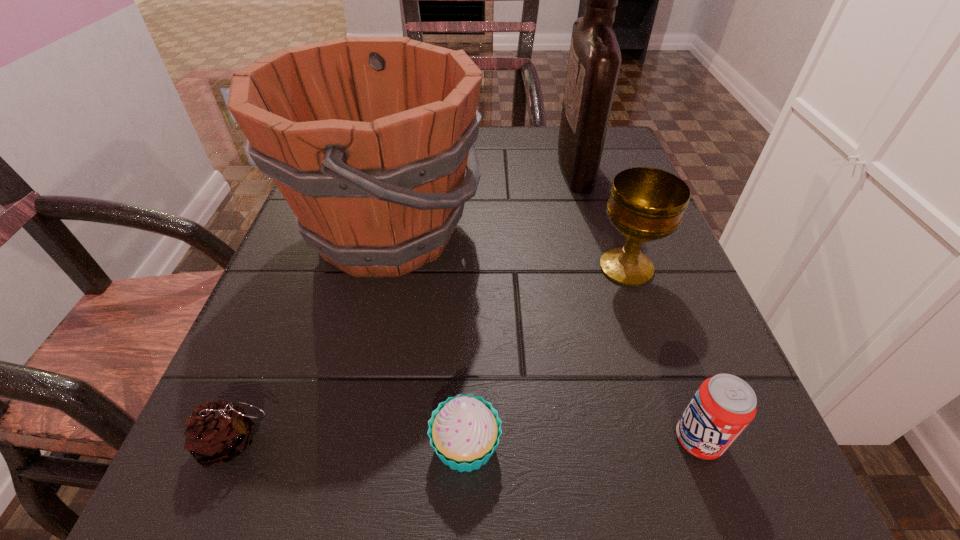
In order to click on free point between the cupcake and the second tallest object in this screenshot , I will do `click(426, 339)`.

Identify the location of vacant space in between the soda can and the chalice. The image size is (960, 540). (662, 353).

This screenshot has width=960, height=540. What are the coordinates of `free space between the chalice and the bucket` in the screenshot? It's located at (507, 250).

At what (x,y) coordinates should I click in order to perform the action: click on vacant point located between the fifth shortest object and the liquor. Please return your answer as a coordinate pair (x, y). Looking at the image, I should click on (481, 199).

This screenshot has width=960, height=540. Identify the location of the fourth closest object to the cupcake. (646, 204).

Locate which object ranks fifth in proximity to the soda can. Please provide its 2D coordinates. Your answer should be formatted as a tuple, i.e. [(x, y)], where the tuple contains the x and y coordinates of a point satisfying the conditions above.

[(217, 432)]

Locate an element on the screen. This screenshot has width=960, height=540. free space that satisfies the following two spatial constraints: 1. on the handle side of the cupcake; 2. on the right side of the bucket is located at coordinates (337, 445).

This screenshot has width=960, height=540. I want to click on free location that satisfies the following two spatial constraints: 1. on the handle side of the second tallest object; 2. on the left side of the cupcake, so click(337, 445).

Where is `vacant space that satisfies the following two spatial constraints: 1. on the handle side of the fifth shortest object; 2. on the right side of the chalice`? The width and height of the screenshot is (960, 540). vacant space that satisfies the following two spatial constraints: 1. on the handle side of the fifth shortest object; 2. on the right side of the chalice is located at coordinates (378, 268).

What are the coordinates of `free space that satisfies the following two spatial constraints: 1. on the label side of the liquor; 2. on the right side of the third tallest object` in the screenshot? It's located at (604, 268).